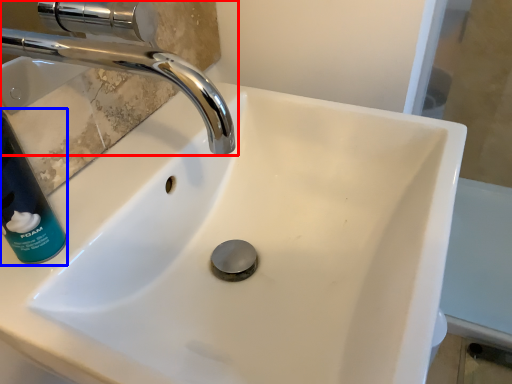
Question: Among these objects, which one is nearest to the camera, tap (highlighted by a red box) or cleaning product (highlighted by a blue box)?

Choices:
 (A) tap
 (B) cleaning product

Answer: (A)